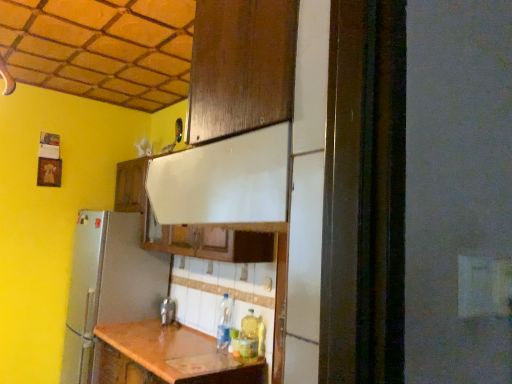
Question: From the image's perspective, is translucent plastic bottle at lower center, which is the first bottle in front-to-back order, above clear plastic bottle at center, which is counted as the 2th bottle, starting from the right?

Choices:
 (A) yes
 (B) no

Answer: (B)

Question: Is translucent plastic bottle at lower center, which is the first bottle in front-to-back order, further to camera compared to clear plastic bottle at center, the 1th bottle in the back-to-front sequence?

Choices:
 (A) yes
 (B) no

Answer: (B)

Question: From a real-world perspective, does translucent plastic bottle at lower center, positioned as the 1th bottle in right-to-left order, stand above clear plastic bottle at center, the 2th bottle in the front-to-back sequence?

Choices:
 (A) no
 (B) yes

Answer: (A)

Question: Does translucent plastic bottle at lower center, acting as the second bottle starting from the back, turn towards clear plastic bottle at center, the 2th bottle in the front-to-back sequence?

Choices:
 (A) no
 (B) yes

Answer: (A)

Question: Is translucent plastic bottle at lower center, positioned as the 1th bottle in right-to-left order, beside clear plastic bottle at center, the 2th bottle in the front-to-back sequence?

Choices:
 (A) no
 (B) yes

Answer: (A)

Question: In terms of height, does metallic silver faucet at center look taller or shorter compared to wooden cabinet at upper center?

Choices:
 (A) tall
 (B) short

Answer: (B)

Question: Is metallic silver faucet at center spatially inside wooden cabinet at upper center, or outside of it?

Choices:
 (A) inside
 (B) outside

Answer: (B)

Question: From the image's perspective, is metallic silver faucet at center positioned above or below wooden cabinet at upper center?

Choices:
 (A) below
 (B) above

Answer: (A)

Question: Considering the relative positions of metallic silver faucet at center and wooden cabinet at upper center in the image provided, is metallic silver faucet at center to the left or to the right of wooden cabinet at upper center?

Choices:
 (A) right
 (B) left

Answer: (A)

Question: From a real-world perspective, relative to translucent plastic bottle at lower center, which is the first bottle in front-to-back order, is clear plastic bottle at center, the first bottle from the left, vertically above or below?

Choices:
 (A) above
 (B) below

Answer: (A)

Question: Is clear plastic bottle at center, which is counted as the 2th bottle, starting from the right, to the left or to the right of translucent plastic bottle at lower center, the second bottle when ordered from left to right, in the image?

Choices:
 (A) right
 (B) left

Answer: (B)

Question: Do you think clear plastic bottle at center, which is counted as the 2th bottle, starting from the right, is within translucent plastic bottle at lower center, acting as the second bottle starting from the back, or outside of it?

Choices:
 (A) outside
 (B) inside

Answer: (A)

Question: From the image's perspective, relative to translucent plastic bottle at lower center, acting as the second bottle starting from the back, is clear plastic bottle at center, the 2th bottle in the front-to-back sequence, above or below?

Choices:
 (A) below
 (B) above

Answer: (B)

Question: In terms of height, does translucent plastic bottle at lower center, positioned as the 1th bottle in right-to-left order, look taller or shorter compared to clear plastic bottle at center, the first bottle from the left?

Choices:
 (A) tall
 (B) short

Answer: (B)

Question: Considering the positions of translucent plastic bottle at lower center, positioned as the 1th bottle in right-to-left order, and clear plastic bottle at center, the 2th bottle in the front-to-back sequence, in the image, is translucent plastic bottle at lower center, positioned as the 1th bottle in right-to-left order, wider or thinner than clear plastic bottle at center, the 2th bottle in the front-to-back sequence,?

Choices:
 (A) thin
 (B) wide

Answer: (A)